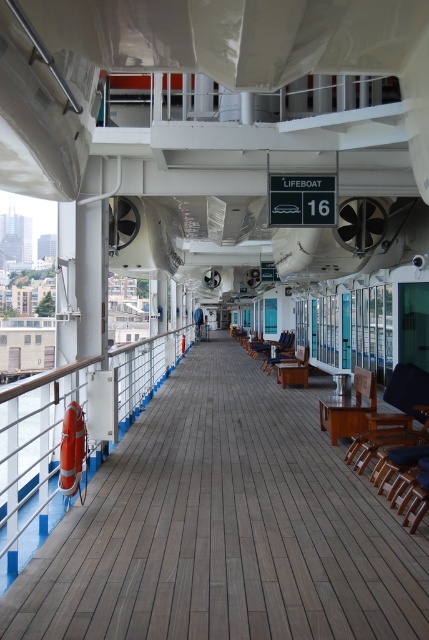
Question: Among these points, which one is nearest to the camera?

Choices:
 (A) (56, 582)
 (B) (166, 356)

Answer: (A)

Question: Which of the following is the closest to the observer?

Choices:
 (A) orange rubber lifebuoy at left
 (B) wooden at center

Answer: (B)

Question: Is wooden at center above orange rubber lifebuoy at left?

Choices:
 (A) yes
 (B) no

Answer: (B)

Question: Is wooden at center smaller than orange rubber lifebuoy at left?

Choices:
 (A) yes
 (B) no

Answer: (A)

Question: Is wooden at center to the right of orange rubber lifebuoy at left from the viewer's perspective?

Choices:
 (A) yes
 (B) no

Answer: (A)